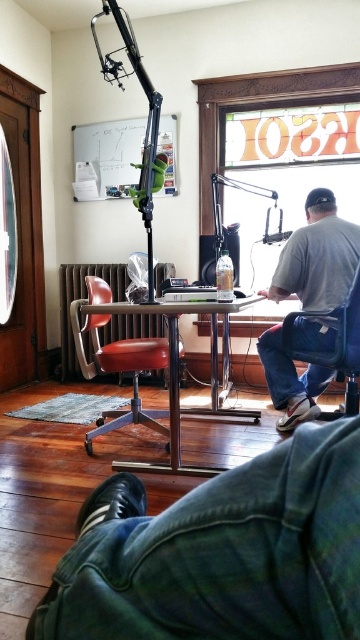
Who is positioned more to the left, leather-like swivel chair at center or matte blue chair at center?

leather-like swivel chair at center

Does leather-like swivel chair at center have a greater width compared to matte blue chair at center?

Yes, leather-like swivel chair at center is wider than matte blue chair at center.

Which is in front, point (87, 289) or point (358, 276)?

Point (358, 276)

Identify the location of leather-like swivel chair at center. (117, 362).

Between point (123, 545) and point (330, 352), which one is positioned in front?

Point (123, 545)

Can you confirm if denim pants at lower right is positioned to the left of matte blue chair at center?

Indeed, denim pants at lower right is positioned on the left side of matte blue chair at center.

What do you see at coordinates (221, 552) in the screenshot? I see `denim pants at lower right` at bounding box center [221, 552].

Where is `denim pants at lower right`? The image size is (360, 640). denim pants at lower right is located at coordinates (221, 552).

Identify the location of denim pants at lower right. click(221, 552).

Does denim pants at lower right appear on the right side of leather-like swivel chair at center?

Yes, denim pants at lower right is to the right of leather-like swivel chair at center.

Find the location of a particular element. The width and height of the screenshot is (360, 640). denim pants at lower right is located at coordinates (221, 552).

You are a GUI agent. You are given a task and a screenshot of the screen. Output one action in this format:
    pyautogui.click(x=<x>, y=<y>)
    Task: Click on the denim pants at lower right
    This screenshot has height=640, width=360.
    Given the screenshot: What is the action you would take?
    221,552